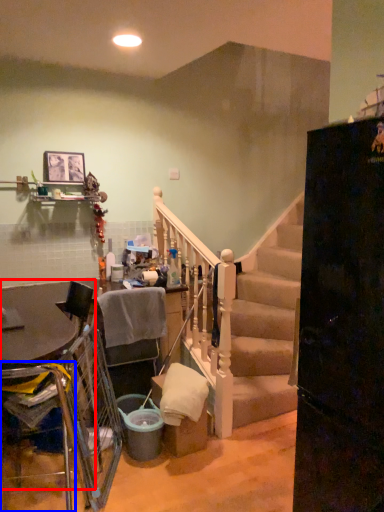
Question: Which of the following is the farthest to the observer, table (highlighted by a red box) or armchair (highlighted by a blue box)?

Choices:
 (A) table
 (B) armchair

Answer: (A)